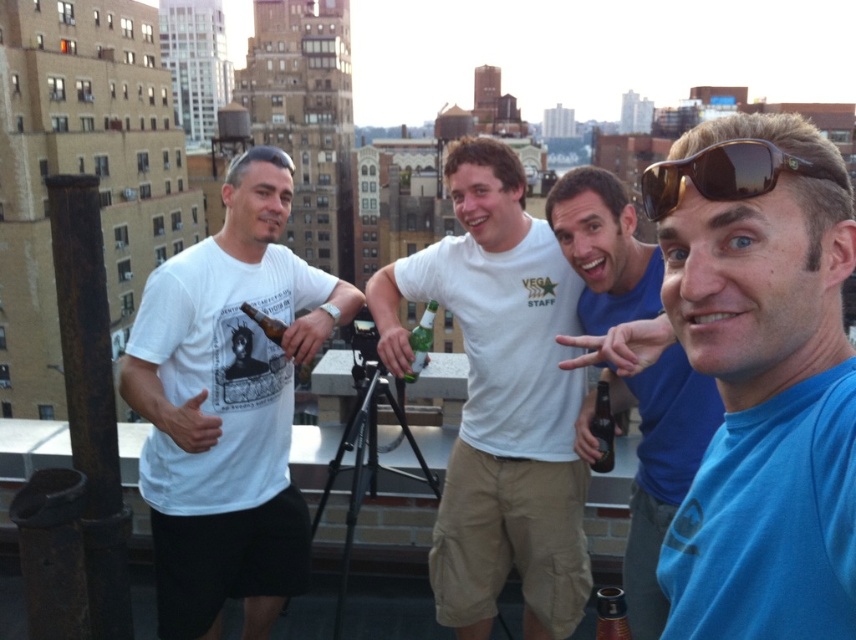
Between blue fabric shirt at right and matte glass beer bottle at center, which one has more height?

blue fabric shirt at right

Is point (749, 124) positioned in front of point (251, 320)?

Yes, it is.

This screenshot has height=640, width=856. I want to click on blue fabric shirt at right, so click(761, 380).

Can you confirm if white cotton t-shirt at center is smaller than matte glass beer bottle at center?

No.

Is white cotton t-shirt at center below matte glass beer bottle at center?

Yes, white cotton t-shirt at center is below matte glass beer bottle at center.

Is point (566, 612) positioned after point (272, 333)?

No.

I want to click on white cotton t-shirt at center, so click(x=500, y=401).

Which of these two, white matte t-shirt at left or brown glass bottle at center, stands shorter?

brown glass bottle at center

Between point (287, 461) and point (601, 436), which one is positioned in front?

Point (601, 436) is in front.

Where is `white matte t-shirt at left`? This screenshot has width=856, height=640. white matte t-shirt at left is located at coordinates (227, 406).